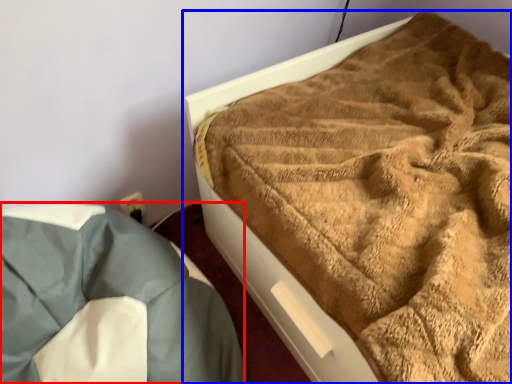
Question: Which object is further to the camera taking this photo, bedding (highlighted by a red box) or bed (highlighted by a blue box)?

Choices:
 (A) bedding
 (B) bed

Answer: (B)